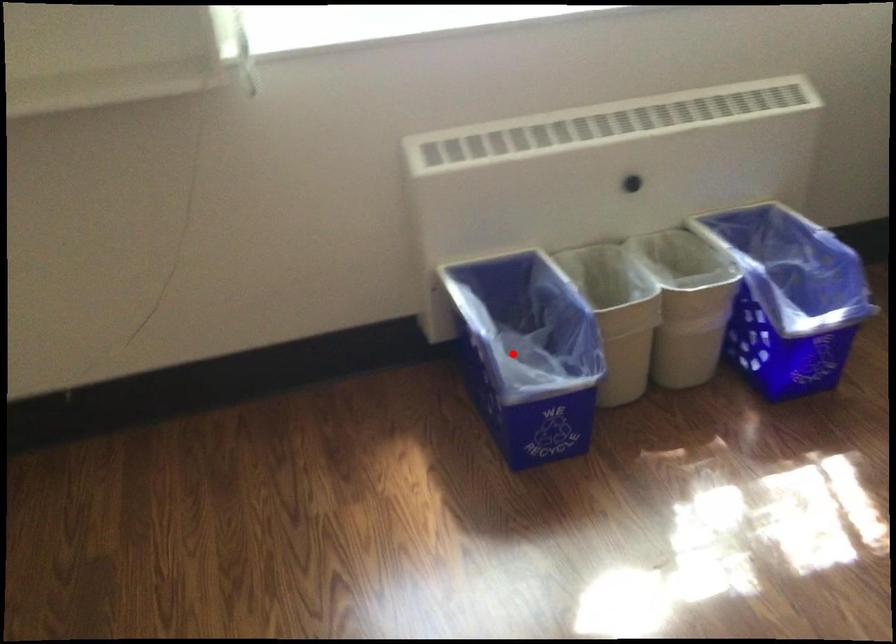
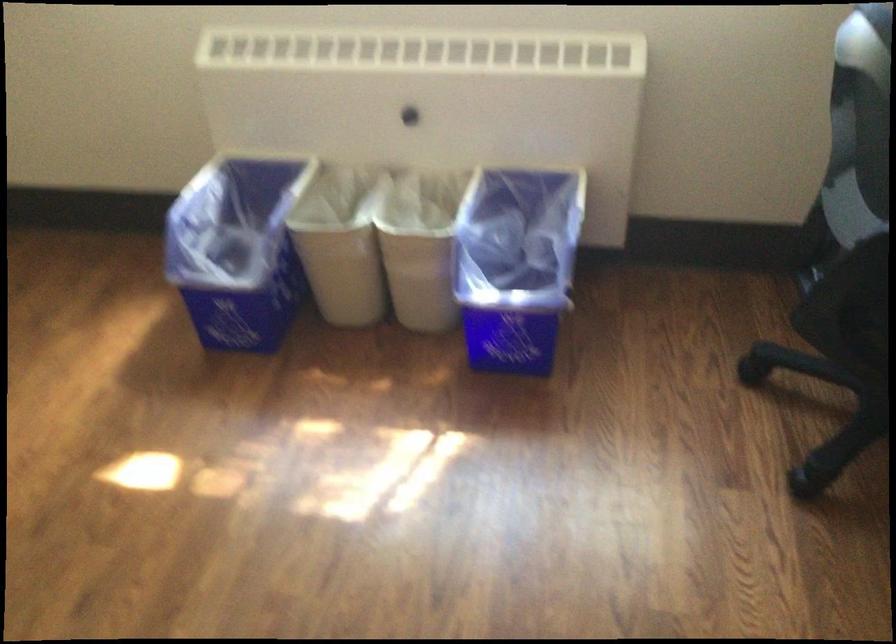
Find the pixel in the second image that matches the highlighted location in the first image.

(237, 249)